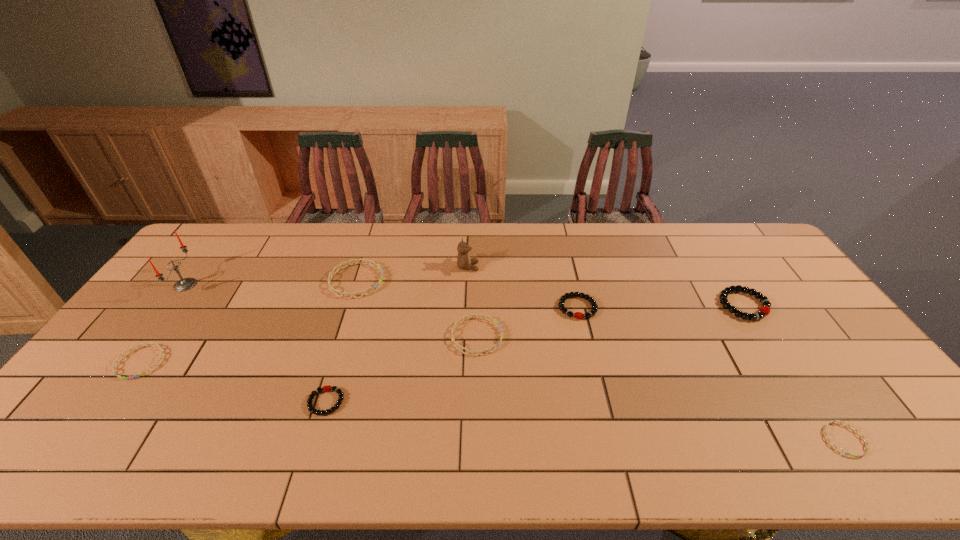
Find the location of `vacant point located between the third biggest blue bracelet and the third blue bracelet from left to right`. vacant point located between the third biggest blue bracelet and the third blue bracelet from left to right is located at coordinates (308, 349).

Find the location of a particular element. free space between the biggest black bracelet and the rightmost blue bracelet is located at coordinates (794, 373).

At what (x,y) coordinates should I click in order to perform the action: click on unoccupied position between the seventh object from left to right and the nearest object. Please return your answer as a coordinate pair (x, y). The height and width of the screenshot is (540, 960). Looking at the image, I should click on (711, 374).

Where is `unoccupied area between the biggest black bracelet and the third smallest blue bracelet`? unoccupied area between the biggest black bracelet and the third smallest blue bracelet is located at coordinates (611, 321).

What are the coordinates of `vacant area that lies between the leftmost blue bracelet and the biggest black bracelet` in the screenshot? It's located at (443, 334).

Locate an element on the screen. object identified as the fourth closest to the second biggest black bracelet is located at coordinates (357, 261).

Choose which object is the fifth nearest neighbor to the farthest blue bracelet. Please provide its 2D coordinates. Your answer should be formatted as a tuple, i.e. [(x, y)], where the tuple contains the x and y coordinates of a point satisfying the conditions above.

[(185, 284)]

Locate which bracelet ranks second in proximity to the second blue bracelet from left to right. Please provide its 2D coordinates. Your answer should be formatted as a tuple, i.e. [(x, y)], where the tuple contains the x and y coordinates of a point satisfying the conditions above.

[(324, 388)]

Select which bracelet appears as the fifth closest to the third object from right to left. Please provide its 2D coordinates. Your answer should be formatted as a tuple, i.e. [(x, y)], where the tuple contains the x and y coordinates of a point satisfying the conditions above.

[(324, 388)]

Locate an element on the screen. blue bracelet identified as the closest to the red candle is located at coordinates (116, 362).